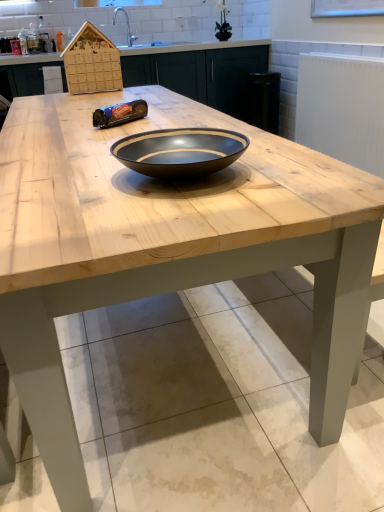
Question: Is white textured radiator at upper right at the right side of black glossy bowl at center?

Choices:
 (A) yes
 (B) no

Answer: (A)

Question: Is white textured radiator at upper right completely or partially outside of black glossy bowl at center?

Choices:
 (A) yes
 (B) no

Answer: (A)

Question: Does white textured radiator at upper right have a greater width compared to black glossy bowl at center?

Choices:
 (A) no
 (B) yes

Answer: (A)

Question: Does white textured radiator at upper right have a larger size compared to black glossy bowl at center?

Choices:
 (A) no
 (B) yes

Answer: (B)

Question: Is white textured radiator at upper right positioned behind black glossy bowl at center?

Choices:
 (A) no
 (B) yes

Answer: (B)

Question: Is white textured radiator at upper right spatially inside wooden cabinetry at center, or outside of it?

Choices:
 (A) inside
 (B) outside

Answer: (B)

Question: Is white textured radiator at upper right in front of or behind wooden cabinetry at center in the image?

Choices:
 (A) front
 (B) behind

Answer: (A)

Question: From the image's perspective, is white textured radiator at upper right above or below wooden cabinetry at center?

Choices:
 (A) above
 (B) below

Answer: (B)

Question: Considering the positions of white textured radiator at upper right and wooden cabinetry at center in the image, is white textured radiator at upper right taller or shorter than wooden cabinetry at center?

Choices:
 (A) tall
 (B) short

Answer: (B)

Question: From the image's perspective, is wooden cabinetry at center positioned above or below white textured radiator at upper right?

Choices:
 (A) above
 (B) below

Answer: (A)

Question: Considering the positions of wooden cabinetry at center and white textured radiator at upper right in the image, is wooden cabinetry at center taller or shorter than white textured radiator at upper right?

Choices:
 (A) short
 (B) tall

Answer: (B)

Question: In the image, is wooden cabinetry at center positioned in front of or behind white textured radiator at upper right?

Choices:
 (A) front
 (B) behind

Answer: (B)

Question: Is wooden cabinetry at center inside the boundaries of white textured radiator at upper right, or outside?

Choices:
 (A) outside
 (B) inside

Answer: (A)

Question: Is white textured radiator at upper right inside the boundaries of black glossy bowl at center, or outside?

Choices:
 (A) inside
 (B) outside

Answer: (B)

Question: Is point (375, 112) positioned closer to the camera than point (200, 164)?

Choices:
 (A) farther
 (B) closer

Answer: (A)